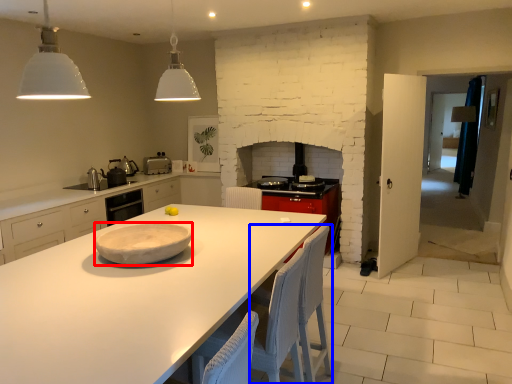
Question: Which object is closer to the camera taking this photo, platter (highlighted by a red box) or chair (highlighted by a blue box)?

Choices:
 (A) platter
 (B) chair

Answer: (A)